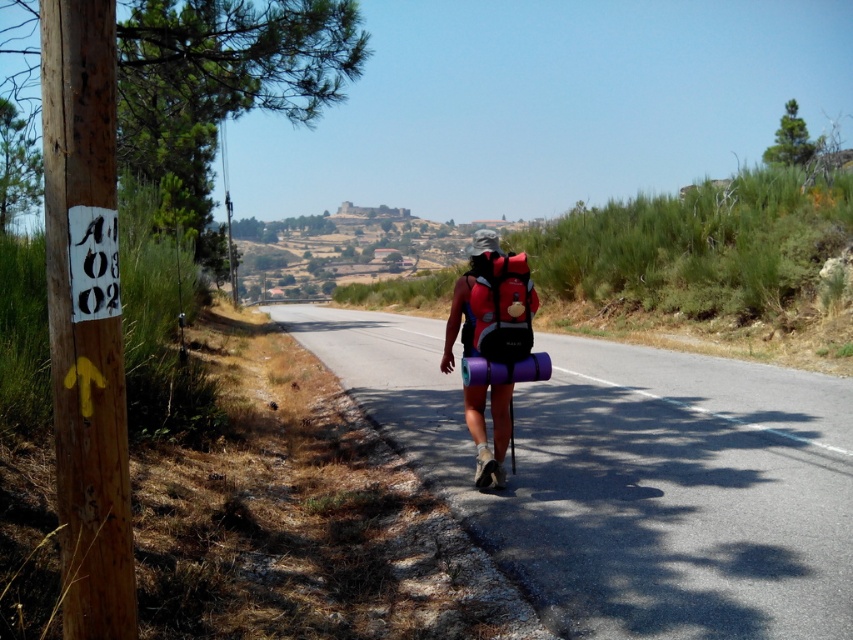
Question: Does purple fabric backpack at center have a smaller size compared to matte red backpack at center?

Choices:
 (A) no
 (B) yes

Answer: (A)

Question: Which point is closer to the camera?

Choices:
 (A) 463,394
 (B) 473,330

Answer: (B)

Question: Can you confirm if purple fabric backpack at center is bigger than matte red backpack at center?

Choices:
 (A) no
 (B) yes

Answer: (B)

Question: Which object appears farthest from the camera in this image?

Choices:
 (A) purple fabric backpack at center
 (B) matte red backpack at center

Answer: (A)

Question: Is purple fabric backpack at center behind matte red backpack at center?

Choices:
 (A) no
 (B) yes

Answer: (B)

Question: Which point is closer to the camera?

Choices:
 (A) (515, 268)
 (B) (477, 323)

Answer: (A)